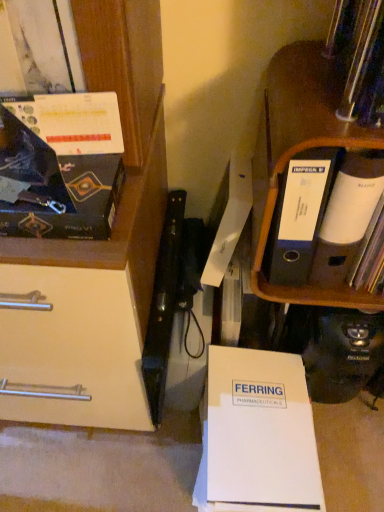
Question: Is matte black magazine at upper left positioned beyond the bounds of black cardboard file at upper right?

Choices:
 (A) no
 (B) yes

Answer: (B)

Question: Is matte black magazine at upper left thinner than black cardboard file at upper right?

Choices:
 (A) yes
 (B) no

Answer: (A)

Question: Considering the relative positions of matte black magazine at upper left and black cardboard file at upper right in the image provided, is matte black magazine at upper left behind black cardboard file at upper right?

Choices:
 (A) yes
 (B) no

Answer: (B)

Question: Can you confirm if matte black magazine at upper left is bigger than black cardboard file at upper right?

Choices:
 (A) no
 (B) yes

Answer: (A)

Question: From the image's perspective, does matte black magazine at upper left appear higher than black cardboard file at upper right?

Choices:
 (A) no
 (B) yes

Answer: (A)

Question: Is matte black magazine at upper left shorter than black cardboard file at upper right?

Choices:
 (A) no
 (B) yes

Answer: (B)

Question: Is matte black magazine at upper left not inside white paper at lower center?

Choices:
 (A) yes
 (B) no

Answer: (A)

Question: Is white paper at lower center located within matte black magazine at upper left?

Choices:
 (A) no
 (B) yes

Answer: (A)

Question: Is white paper at lower center at the back of matte black magazine at upper left?

Choices:
 (A) no
 (B) yes

Answer: (A)

Question: From the image's perspective, is matte black magazine at upper left on top of white paper at lower center?

Choices:
 (A) yes
 (B) no

Answer: (A)

Question: Does matte black magazine at upper left have a smaller size compared to white paper at lower center?

Choices:
 (A) yes
 (B) no

Answer: (A)

Question: Does matte black magazine at upper left have a greater width compared to white paper at lower center?

Choices:
 (A) no
 (B) yes

Answer: (A)

Question: Is white paper at lower center further to camera compared to matte black magazine at upper left?

Choices:
 (A) yes
 (B) no

Answer: (A)